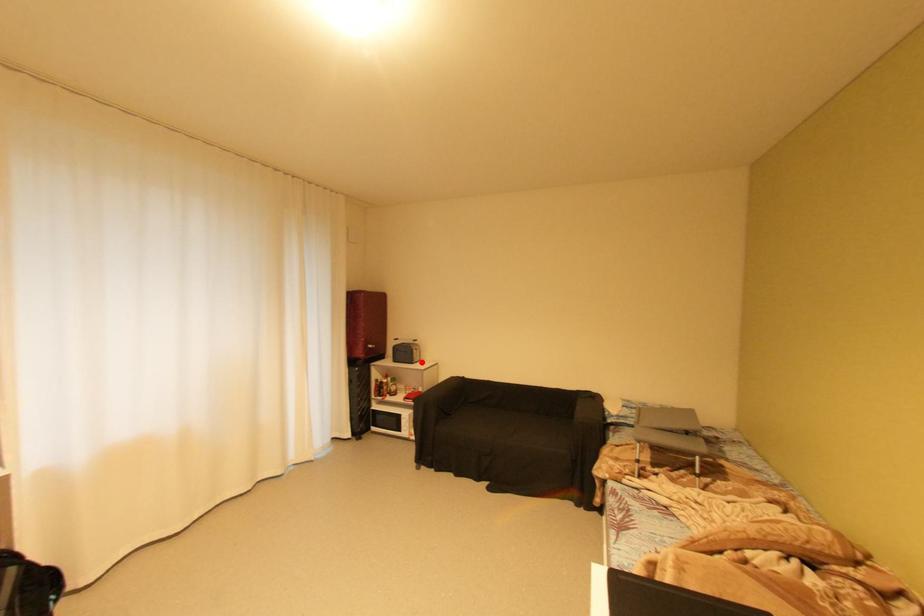
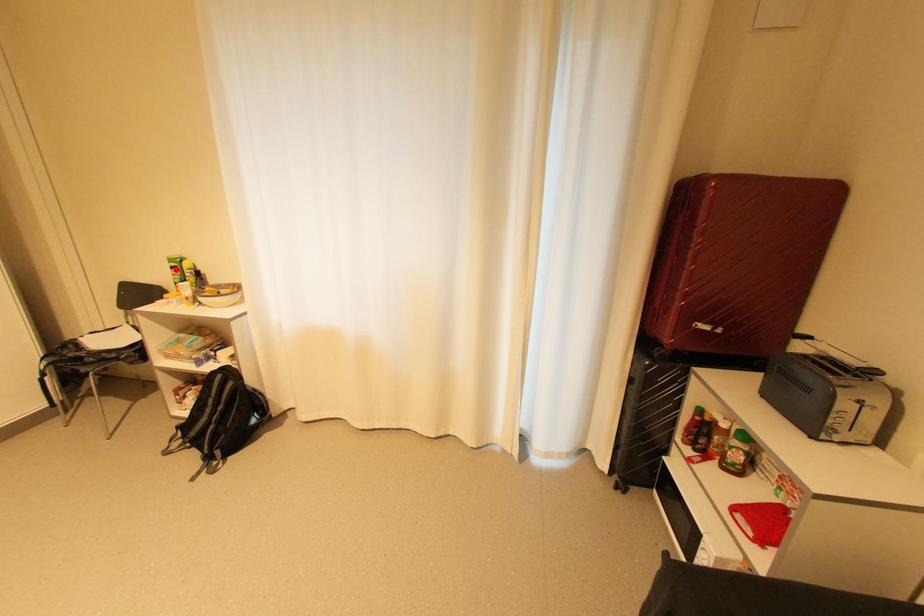
I am providing you with two images of the same scene from different viewpoints. A red point is marked on the first image and another point is marked on the second image. Does the point marked in image1 correspond to the same location as the one in image2?

No